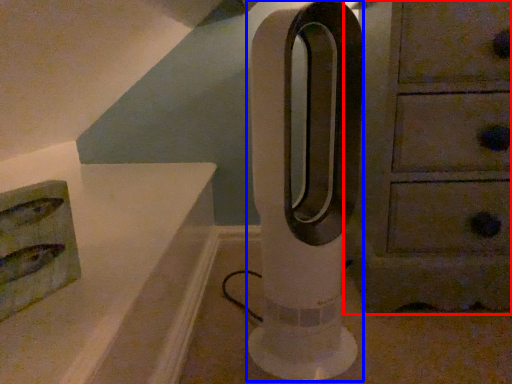
Question: Which object is further to the camera taking this photo, chest of drawers (highlighted by a red box) or pillar (highlighted by a blue box)?

Choices:
 (A) chest of drawers
 (B) pillar

Answer: (A)